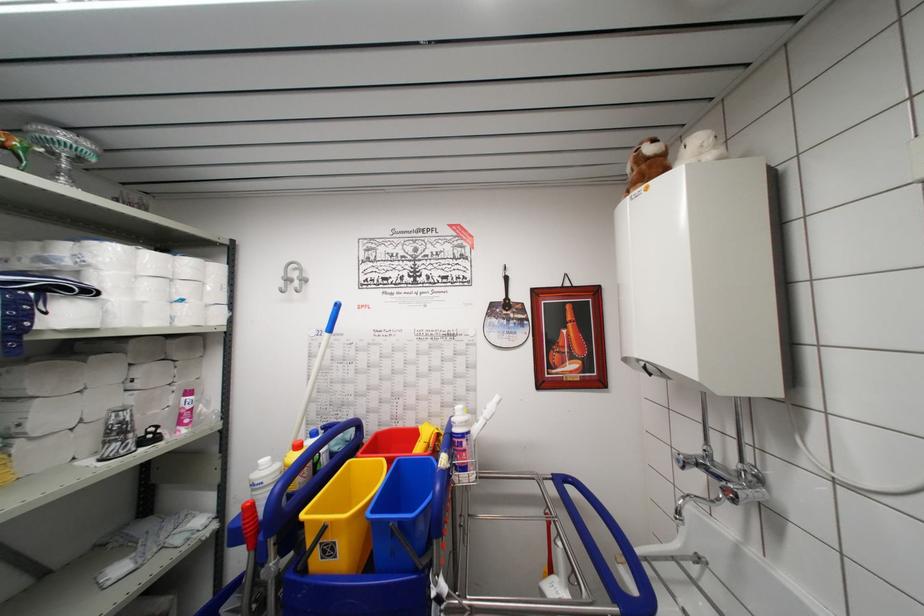
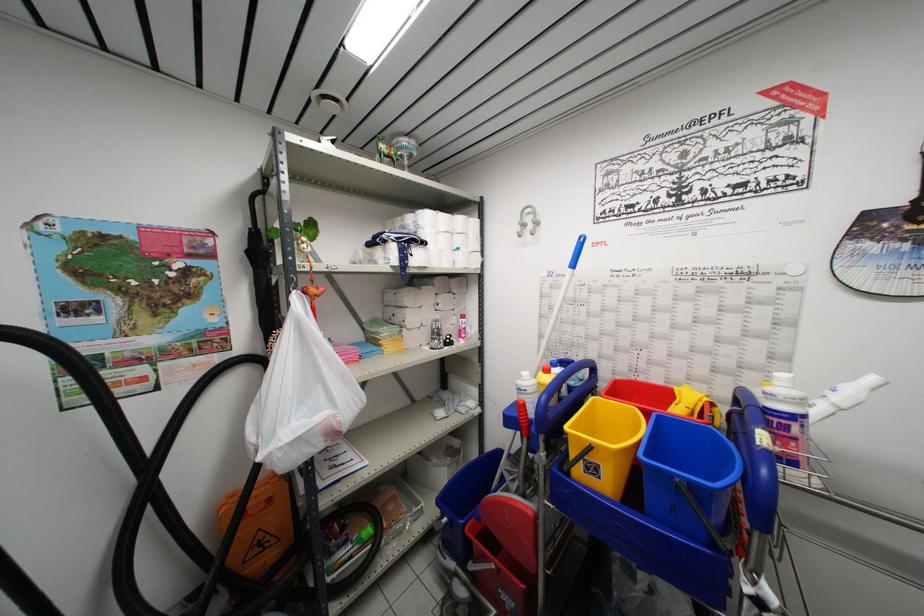
Question: Based on the continuous images, in which direction is the camera rotating? Reply with the corresponding letter.

Choices:
 (A) Left
 (B) Right
 (C) Up
 (D) Down

Answer: (A)